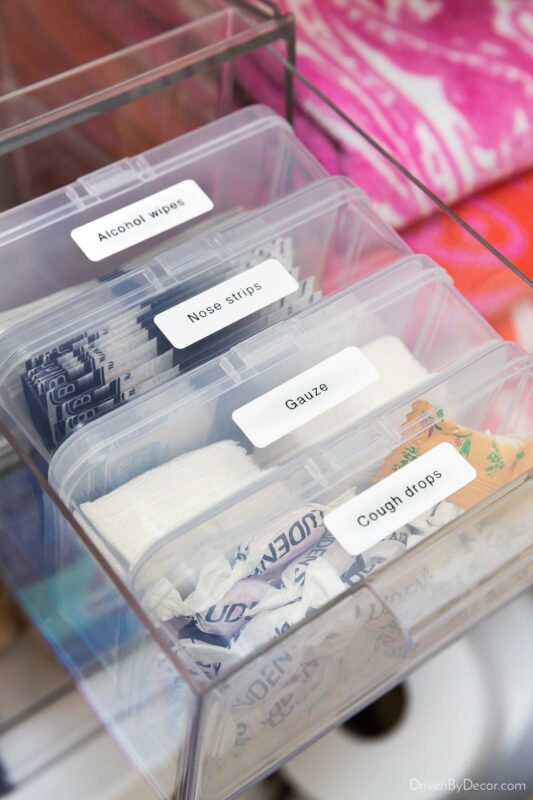
The image size is (533, 800). I want to click on cabinet, so click(90, 34).